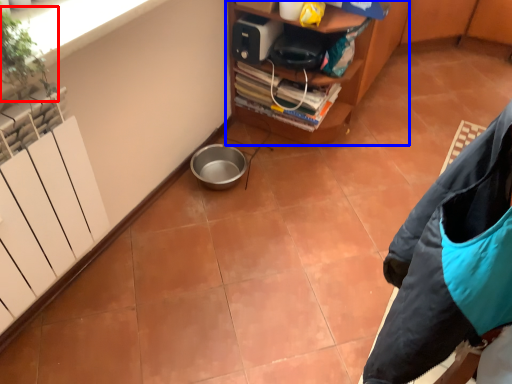
Question: Which of the following is the closest to the observer, plant (highlighted by a red box) or furniture (highlighted by a blue box)?

Choices:
 (A) plant
 (B) furniture

Answer: (A)